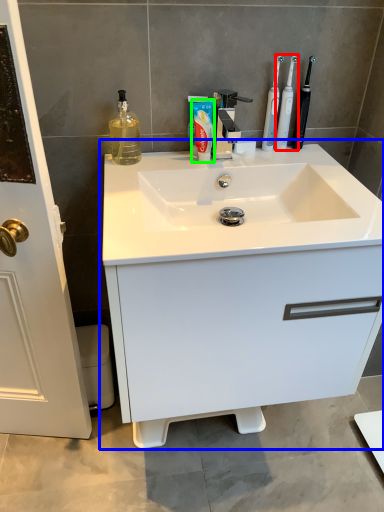
Question: Considering the real-world distances, which object is farthest from toothbrush (highlighted by a red box)? bathroom cabinet (highlighted by a blue box) or shaving cream (highlighted by a green box)?

Choices:
 (A) bathroom cabinet
 (B) shaving cream

Answer: (A)